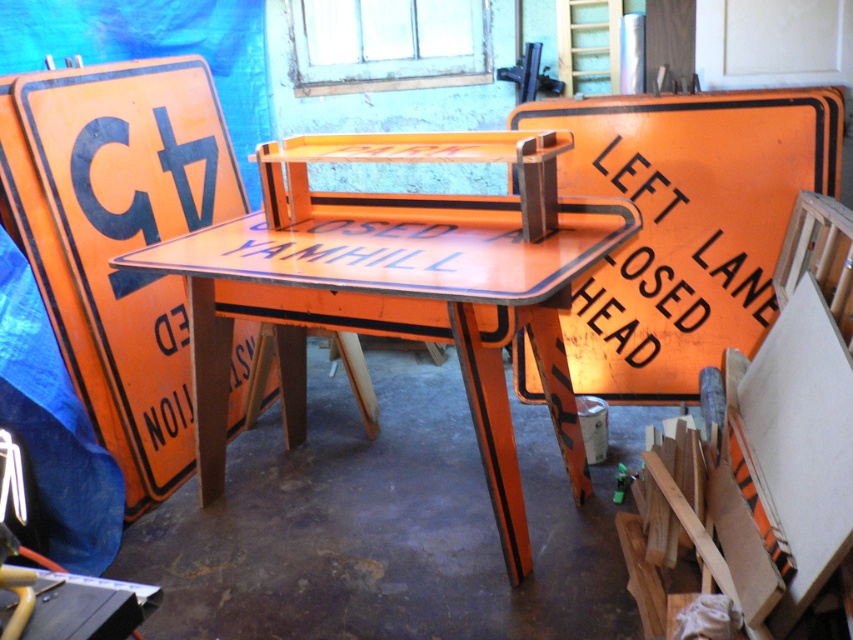
You are standing in the workshop and need to locate the orange painted metal sign at center. What are the coordinates of its position?

The orange painted metal sign at center is located at coordinates point (x=685, y=225).

You are organizing tools in a workshop and need to place the green plastic hammer at lower right. There is an orange painted metal sign at center in the way. Can you move the hammer without moving the sign?

The orange painted metal sign at center is in front of the green plastic hammer at lower right, so you would need to move the sign first to access the hammer.

What is located at the coordinates point [685,225] in the image?

The orange painted metal sign at center is located at point [685,225].